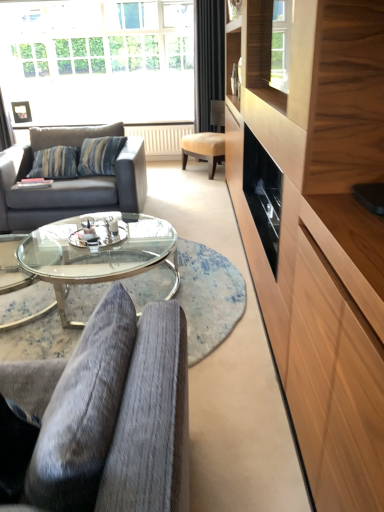
Question: Is transparent glass coffee table at center located within black velvet curtain at upper center?

Choices:
 (A) no
 (B) yes

Answer: (A)

Question: Is black velvet curtain at upper center at the right side of transparent glass coffee table at center?

Choices:
 (A) no
 (B) yes

Answer: (B)

Question: From a real-world perspective, is black velvet curtain at upper center physically above transparent glass coffee table at center?

Choices:
 (A) yes
 (B) no

Answer: (A)

Question: Is black velvet curtain at upper center in contact with transparent glass coffee table at center?

Choices:
 (A) yes
 (B) no

Answer: (B)

Question: Does black velvet curtain at upper center have a lesser height compared to transparent glass coffee table at center?

Choices:
 (A) yes
 (B) no

Answer: (B)

Question: From a real-world perspective, is black velvet curtain at upper center positioned above or below velvet grey armchair at center, the 1th chair in the bottom-to-top sequence?

Choices:
 (A) below
 (B) above

Answer: (B)

Question: Considering the relative positions of black velvet curtain at upper center and velvet grey armchair at center, the 2th chair positioned from the right, in the image provided, is black velvet curtain at upper center to the left or to the right of velvet grey armchair at center, the 2th chair positioned from the right,?

Choices:
 (A) left
 (B) right

Answer: (B)

Question: Considering the positions of black velvet curtain at upper center and velvet grey armchair at center, the 1th chair viewed from the front, in the image, is black velvet curtain at upper center taller or shorter than velvet grey armchair at center, the 1th chair viewed from the front,?

Choices:
 (A) short
 (B) tall

Answer: (B)

Question: In the image, is black velvet curtain at upper center positioned in front of or behind velvet grey armchair at center, which appears as the second chair when viewed from the back?

Choices:
 (A) front
 (B) behind

Answer: (B)

Question: Is black velvet curtain at upper center wider or thinner than transparent glass window at upper center?

Choices:
 (A) wide
 (B) thin

Answer: (B)

Question: Considering the positions of point (195, 75) and point (150, 17), is point (195, 75) closer or farther from the camera than point (150, 17)?

Choices:
 (A) farther
 (B) closer

Answer: (A)

Question: From the image's perspective, is black velvet curtain at upper center located above or below transparent glass window at upper center?

Choices:
 (A) above
 (B) below

Answer: (B)

Question: Choose the correct answer: Is black velvet curtain at upper center inside transparent glass window at upper center or outside it?

Choices:
 (A) outside
 (B) inside

Answer: (A)

Question: From their relative heights in the image, would you say wooden cabinet at right is taller or shorter than gray fabric couch at left?

Choices:
 (A) tall
 (B) short

Answer: (A)

Question: In the image, is wooden cabinet at right positioned in front of or behind gray fabric couch at left?

Choices:
 (A) behind
 (B) front

Answer: (B)